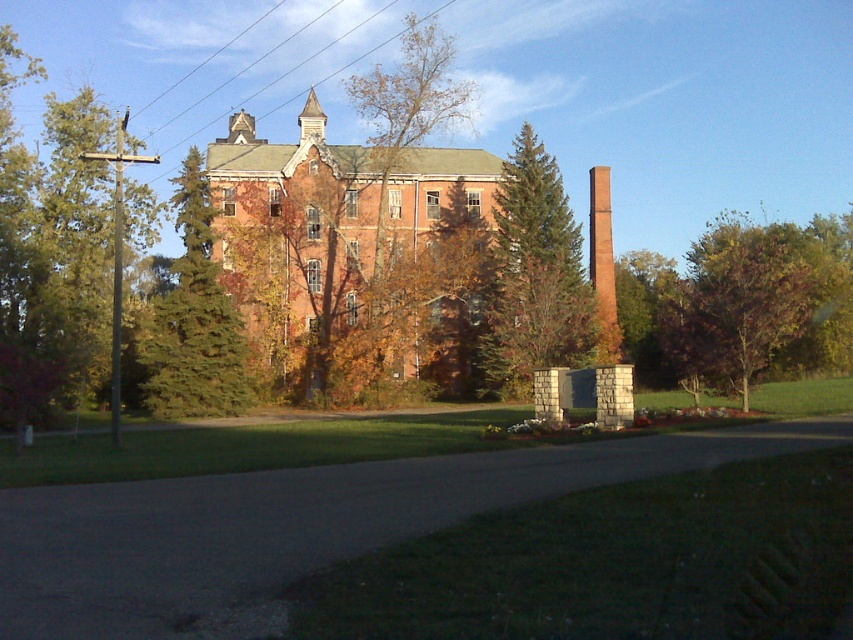
You are standing on the lawn in front of the brick building at center and the brown leafy tree at center. If you look towards the building, which one appears closer to you?

The brick building at center is in front of the brown leafy tree at center, so it appears closer to you.